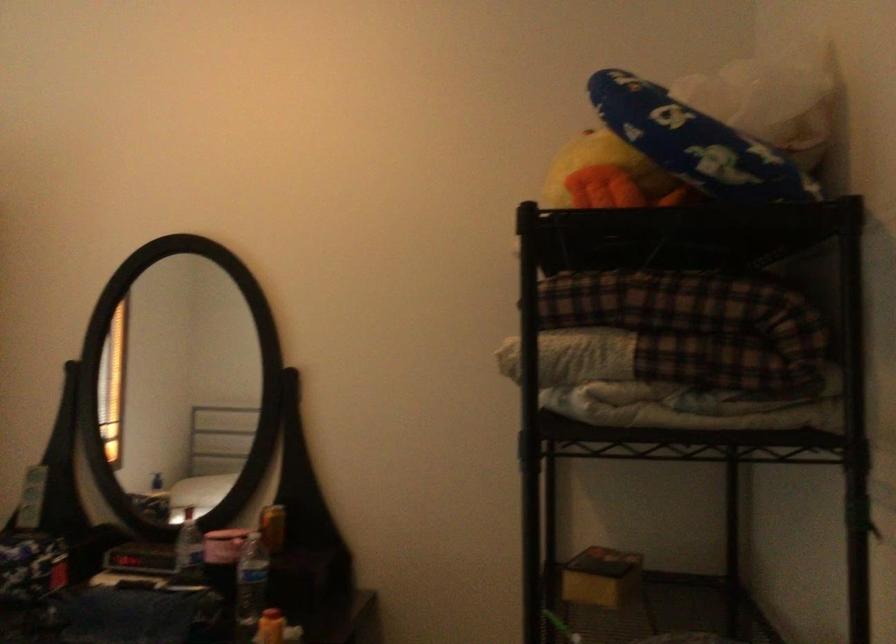
Where is `plastic water bottle`? The width and height of the screenshot is (896, 644). plastic water bottle is located at coordinates pos(250,585).